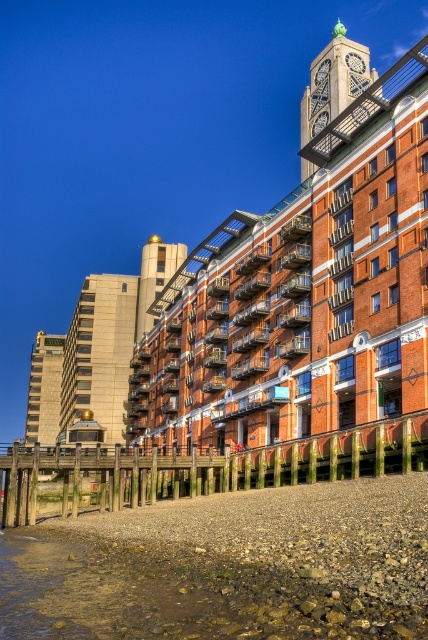
Question: Does beige stone tower at left have a larger size compared to gold polished metal clock tower at center?

Choices:
 (A) yes
 (B) no

Answer: (A)

Question: Which of the following is the closest to the observer?

Choices:
 (A) brick building at center
 (B) beige stone tower at left

Answer: (A)

Question: Based on their relative distances, which object is nearer to the beige stone tower at left?

Choices:
 (A) gold polished metal clock tower at center
 (B) brick building at center
 (C) gold metallic tower at upper center

Answer: (C)

Question: Is brick building at center in front of gold metallic tower at upper center?

Choices:
 (A) no
 (B) yes

Answer: (B)

Question: Which point appears farthest from the camera in this image?

Choices:
 (A) (32, 371)
 (B) (302, 145)
 (C) (91, 352)
 (D) (154, 272)

Answer: (B)

Question: Is gold polished metal clock tower at center to the left of gold metallic tower at upper center from the viewer's perspective?

Choices:
 (A) no
 (B) yes

Answer: (B)